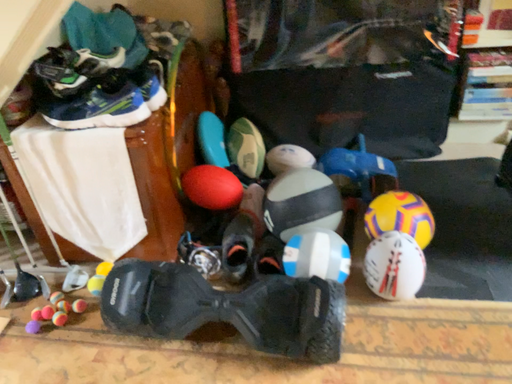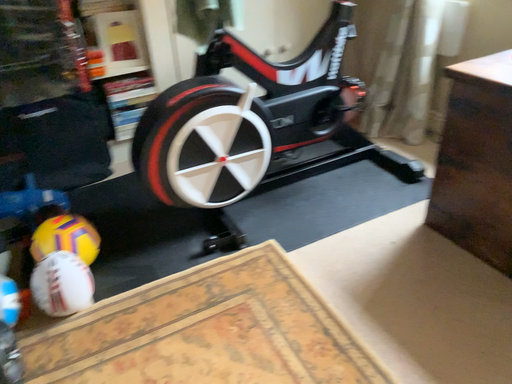
Question: How did the camera likely rotate when shooting the video?

Choices:
 (A) rotated right
 (B) rotated left

Answer: (A)